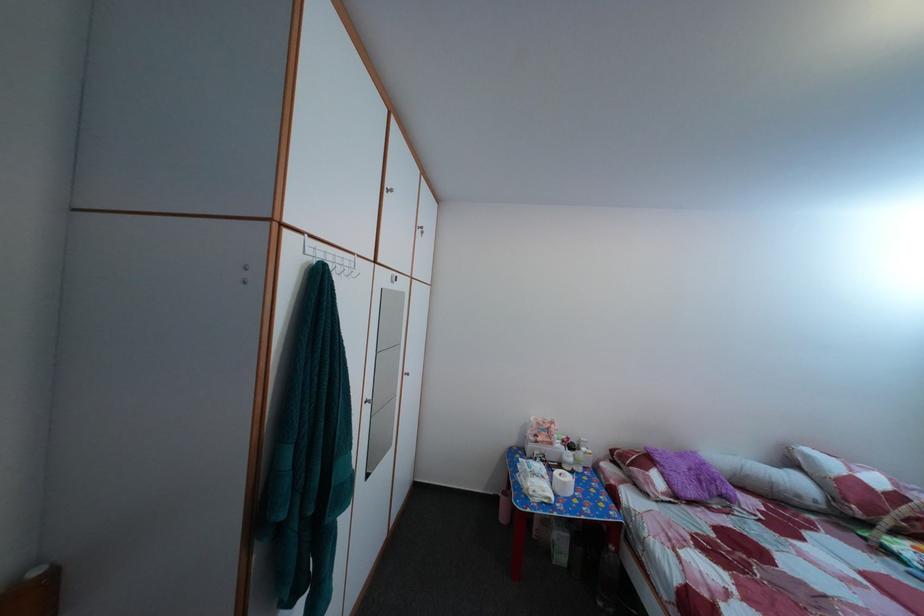
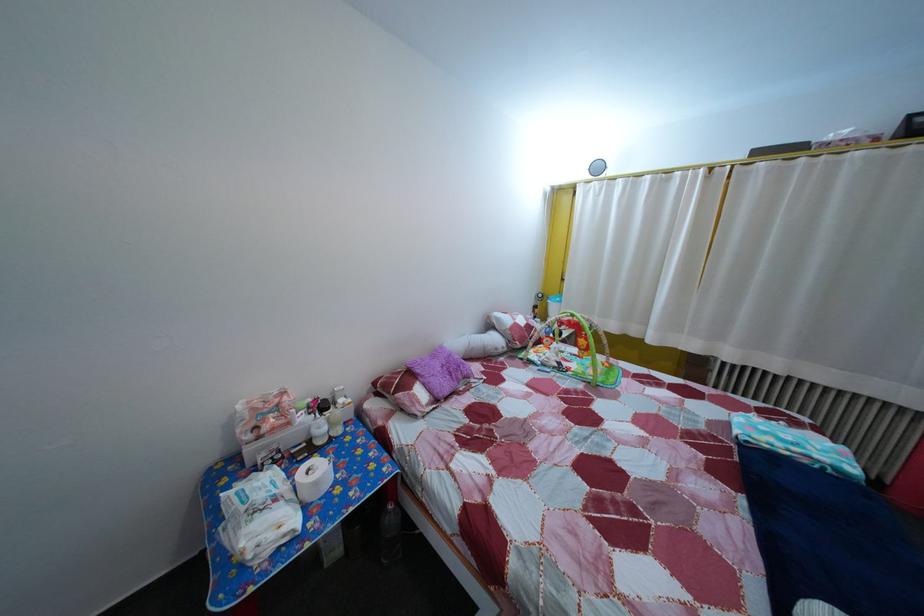
Find the pixel in the second image that matches (568,453) in the first image.

(311, 427)